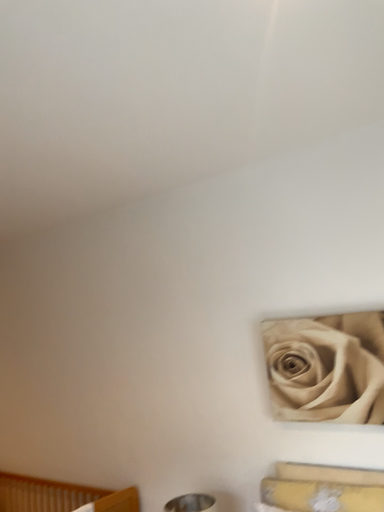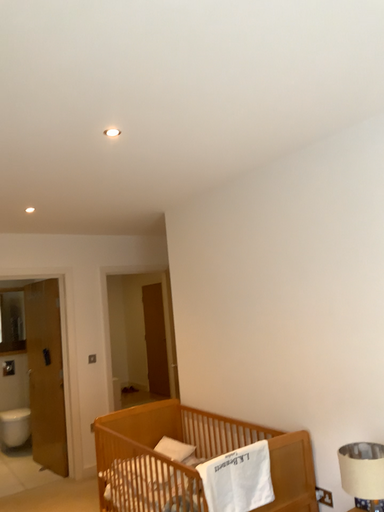
Question: How did the camera likely rotate when shooting the video?

Choices:
 (A) rotated right
 (B) rotated left

Answer: (B)